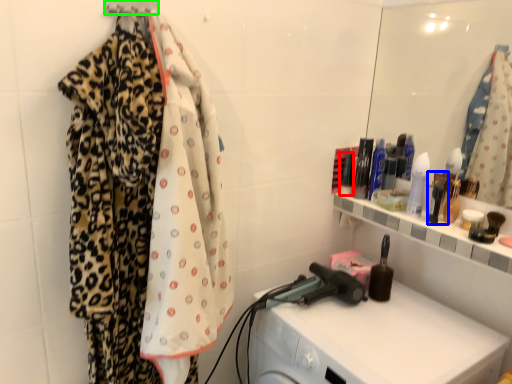
Question: Estimate the real-world distances between objects in this image. Which object is closer to toiletry (highlighted by a red box), toiletry (highlighted by a blue box) or hanger (highlighted by a green box)?

Choices:
 (A) toiletry
 (B) hanger

Answer: (A)